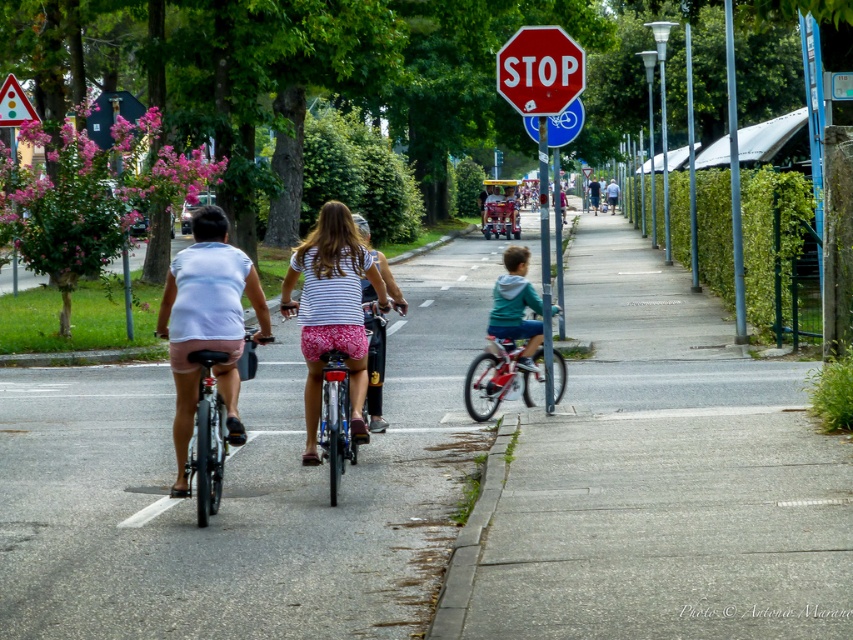
You are a delivery person who needs to choose between the blue metallic bicycle at upper center and the brushed metal triangle at upper left for a long trip. Which one is more suitable based on their sizes?

The blue metallic bicycle at upper center is larger in size than the brushed metal triangle at upper left, so it is more suitable for a long trip.

You are a pedestrian standing on the sidewalk and see the white matte shorts at left and the blue metallic bicycle at upper center. Which one is closer to the left edge of the road?

The white matte shorts at left is closer to the left edge of the road because it is positioned on the left side of the blue metallic bicycle at upper center.